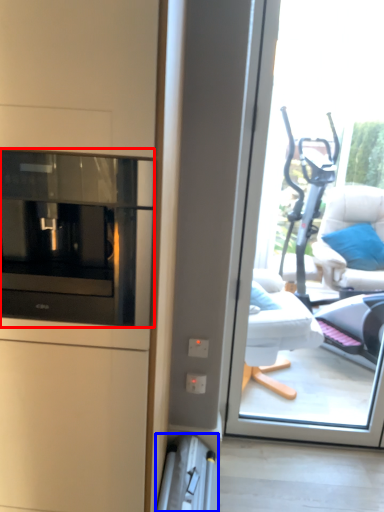
Question: Which point is further to the camera, home appliance (highlighted by a red box) or appliance (highlighted by a blue box)?

Choices:
 (A) home appliance
 (B) appliance

Answer: (B)